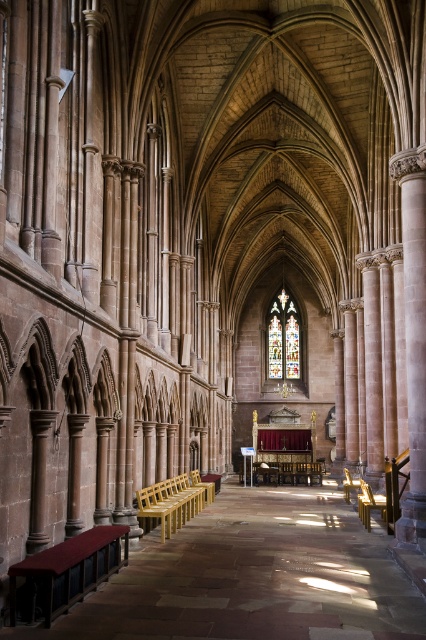
Question: Is golden polished wood bench at lower left bigger than stained glass at center?

Choices:
 (A) no
 (B) yes

Answer: (A)

Question: Among these objects, which one is farthest from the camera?

Choices:
 (A) stained glass at center
 (B) golden polished wood bench at lower left

Answer: (A)

Question: From the image, what is the correct spatial relationship of golden polished wood bench at lower left in relation to stained glass at center?

Choices:
 (A) below
 (B) above

Answer: (A)

Question: Is golden polished wood bench at lower left behind stained glass at center?

Choices:
 (A) yes
 (B) no

Answer: (B)

Question: Among these objects, which one is farthest from the camera?

Choices:
 (A) golden polished wood bench at lower left
 (B) stained glass at center

Answer: (B)